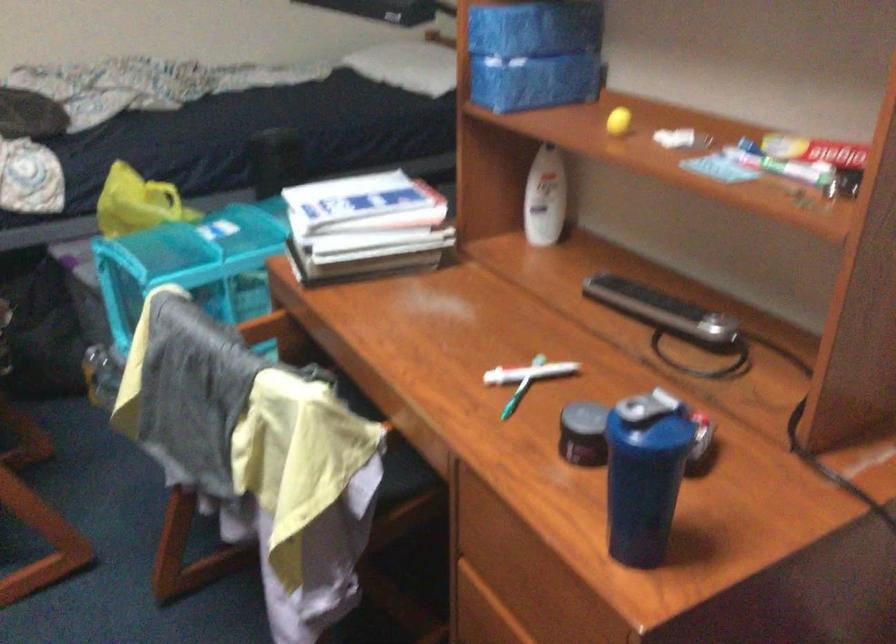
You are a GUI agent. You are given a task and a screenshot of the screen. Output one action in this format:
    pyautogui.click(x=<x>, y=<y>)
    Task: Click on the small yellow ball
    The image size is (896, 644).
    Given the screenshot: What is the action you would take?
    pyautogui.click(x=617, y=120)